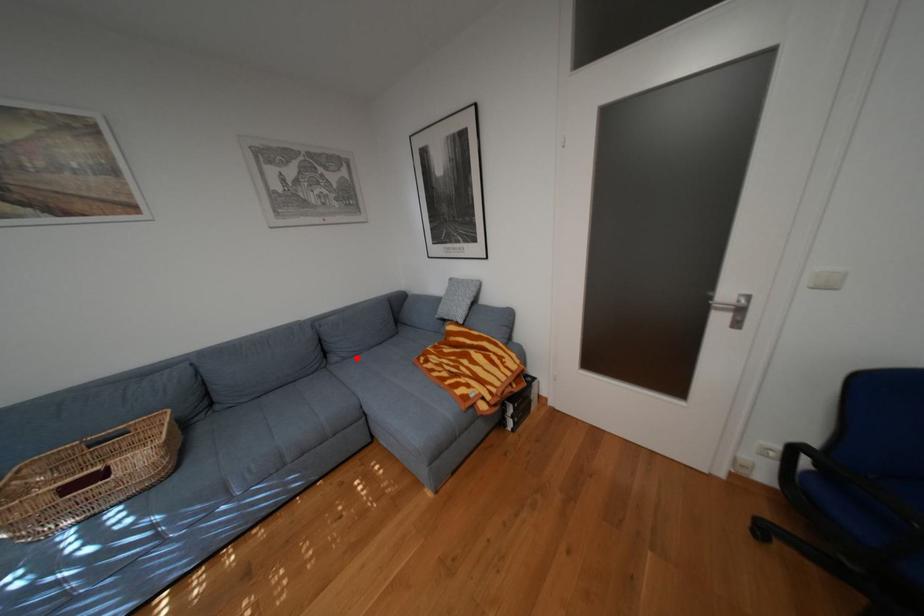
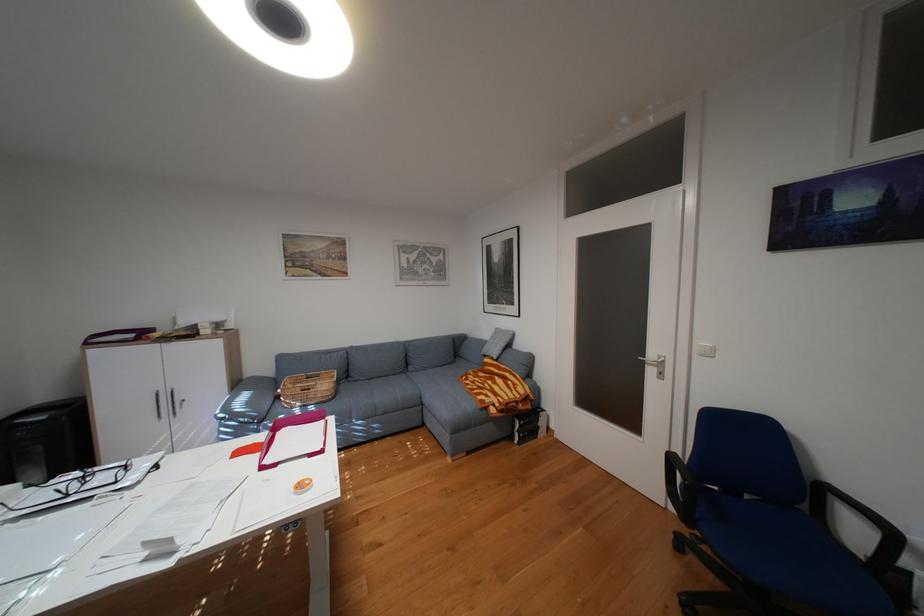
Locate, in the second image, the point that corresponds to the highlighted location in the first image.

(430, 370)